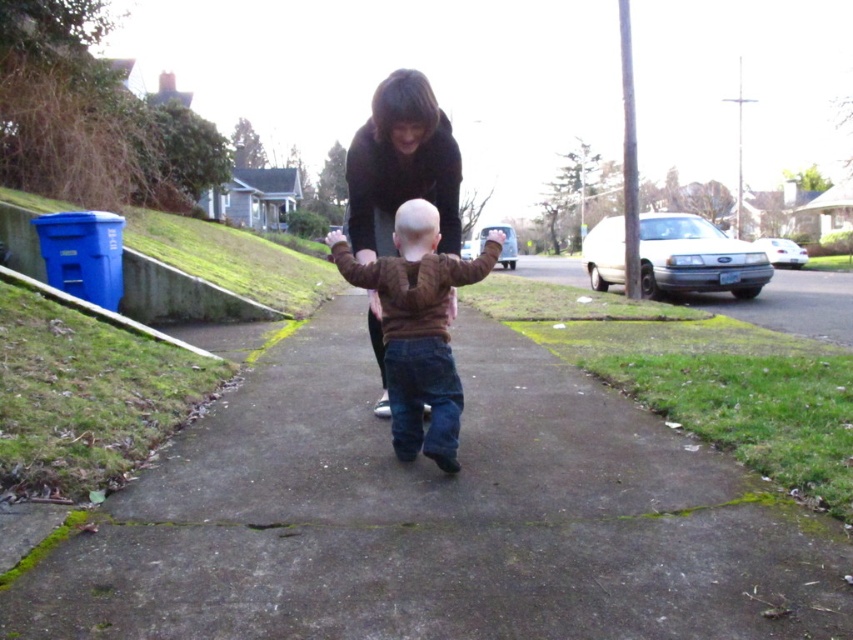
Consider the image. Which is more to the right, concrete at center or brown fuzzy sweater at center?

Positioned to the right is concrete at center.

Who is taller, concrete at center or brown fuzzy sweater at center?

brown fuzzy sweater at center

Based on the photo, who is more forward, (518, 396) or (450, 449)?

Point (450, 449)

This screenshot has height=640, width=853. Find the location of `concrete at center`. concrete at center is located at coordinates (436, 518).

Does concrete at center appear on the right side of dark brown sweater at center?

In fact, concrete at center is to the left of dark brown sweater at center.

Which is in front, point (496, 348) or point (407, 195)?

Positioned in front is point (407, 195).

Where is `concrete at center`? The height and width of the screenshot is (640, 853). concrete at center is located at coordinates (436, 518).

Which is more to the left, brown fuzzy sweater at center or dark brown sweater at center?

Positioned to the left is brown fuzzy sweater at center.

Is brown fuzzy sweater at center wider than dark brown sweater at center?

Correct, the width of brown fuzzy sweater at center exceeds that of dark brown sweater at center.

This screenshot has height=640, width=853. What do you see at coordinates (418, 326) in the screenshot?
I see `brown fuzzy sweater at center` at bounding box center [418, 326].

Where is `brown fuzzy sweater at center`? The height and width of the screenshot is (640, 853). brown fuzzy sweater at center is located at coordinates (418, 326).